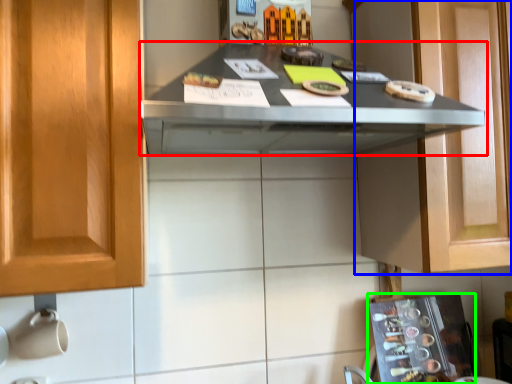
Question: Which object is positioned closest to countertop (highlighted by a red box)? Select from cabinetry (highlighted by a blue box) and appliance (highlighted by a green box).

Choices:
 (A) cabinetry
 (B) appliance

Answer: (A)